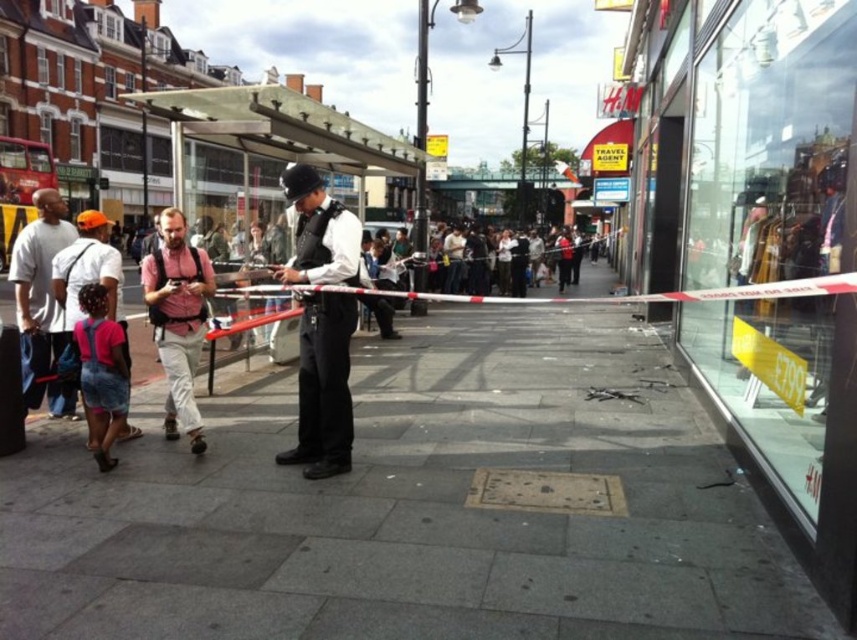
You are a drone operator trying to capture a photo of the scene. You need to adjust your drone to focus on two specific points in the image. The first point is at coordinates point (309, 180) and the second is at point (33, 401). Which point should you focus on first if you want to capture the closest point to the camera first?

Point (309, 180) is closer to the viewer than point (33, 401), so you should focus on point (309, 180) first.